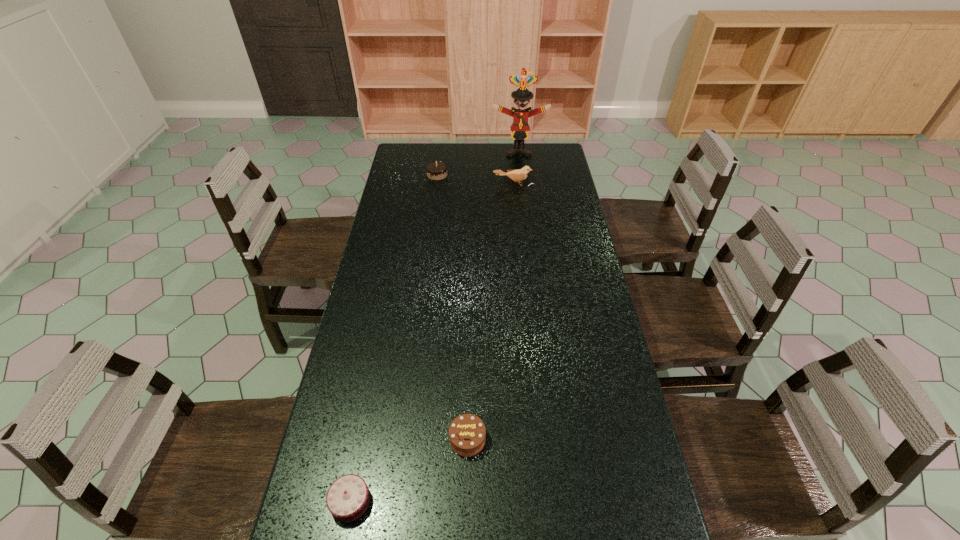
Locate an element on the screen. The image size is (960, 540). nutcracker is located at coordinates (520, 127).

Image resolution: width=960 pixels, height=540 pixels. Find the location of `the farthest object`. the farthest object is located at coordinates (x=520, y=127).

Identify the location of bird. This screenshot has height=540, width=960. (518, 175).

Identify the location of the fourth shortest object. (518, 175).

Find the location of a particular element. The width and height of the screenshot is (960, 540). the farthest chocolate cake is located at coordinates click(436, 170).

Locate an element on the screen. the second farthest object is located at coordinates (436, 170).

I want to click on the second farthest chocolate cake, so click(x=467, y=432).

At what (x,y) coordinates should I click in order to perform the action: click on the rightmost chocolate cake. Please return your answer as a coordinate pair (x, y). Looking at the image, I should click on (467, 432).

Where is `the leftmost chocolate cake`? This screenshot has height=540, width=960. the leftmost chocolate cake is located at coordinates (348, 497).

Where is `the shortest chocolate cake`? the shortest chocolate cake is located at coordinates (348, 497).